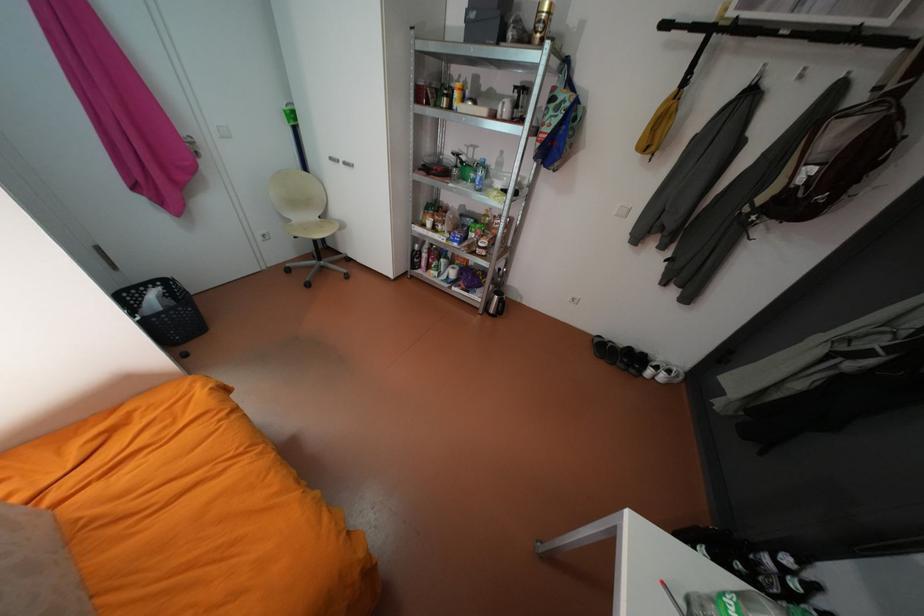
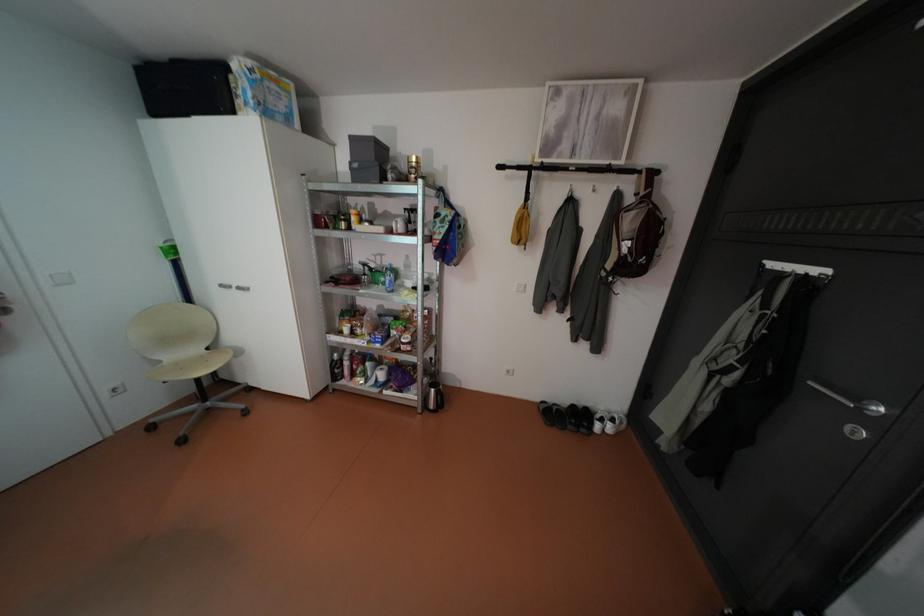
Where in the second image is the point corresponding to the point at 809,179 from the first image?

(634, 249)